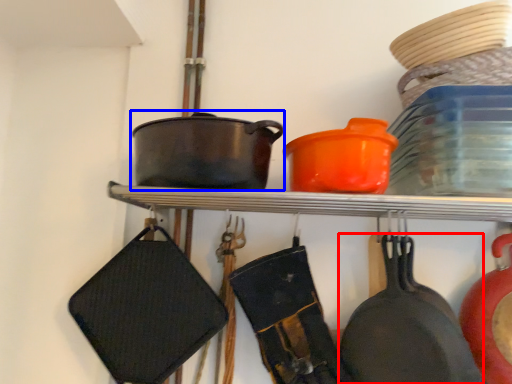
Question: Among these objects, which one is nearest to the camera, frying pan (highlighted by a red box) or wok (highlighted by a blue box)?

Choices:
 (A) frying pan
 (B) wok

Answer: (A)